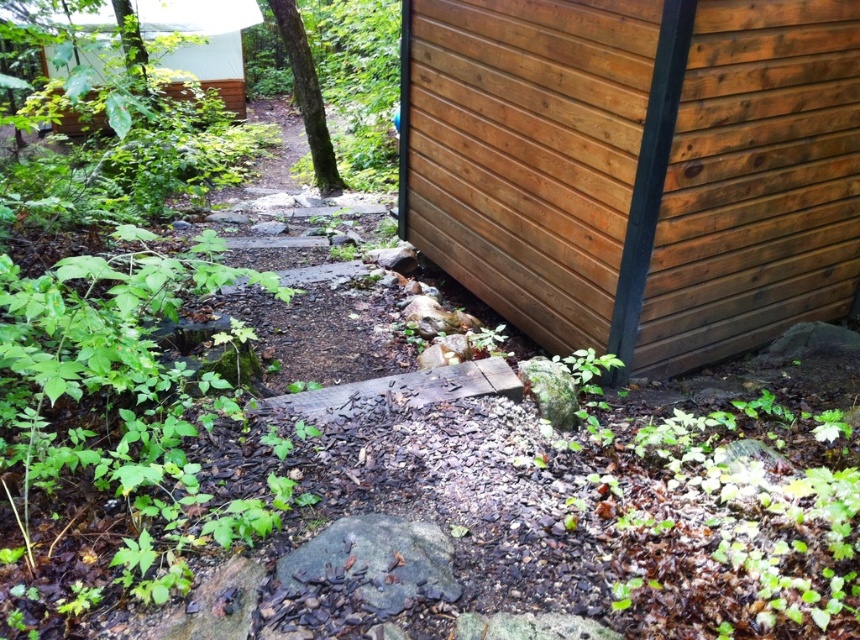
Is white wood hut at upper left shorter than green rough bark tree at upper left?

Yes.

Does white wood hut at upper left come in front of green rough bark tree at upper left?

No.

Locate an element on the screen. Image resolution: width=860 pixels, height=640 pixels. white wood hut at upper left is located at coordinates (203, 40).

Who is positioned more to the right, wooden hut at right or green rough bark tree at upper left?

wooden hut at right is more to the right.

Does point (747, 125) come in front of point (326, 129)?

Yes, point (747, 125) is closer to viewer.

Locate an element on the screen. Image resolution: width=860 pixels, height=640 pixels. wooden hut at right is located at coordinates (636, 168).

Who is taller, wooden hut at right or white wood hut at upper left?

Standing taller between the two is wooden hut at right.

What do you see at coordinates (636, 168) in the screenshot? I see `wooden hut at right` at bounding box center [636, 168].

The image size is (860, 640). I want to click on wooden hut at right, so click(636, 168).